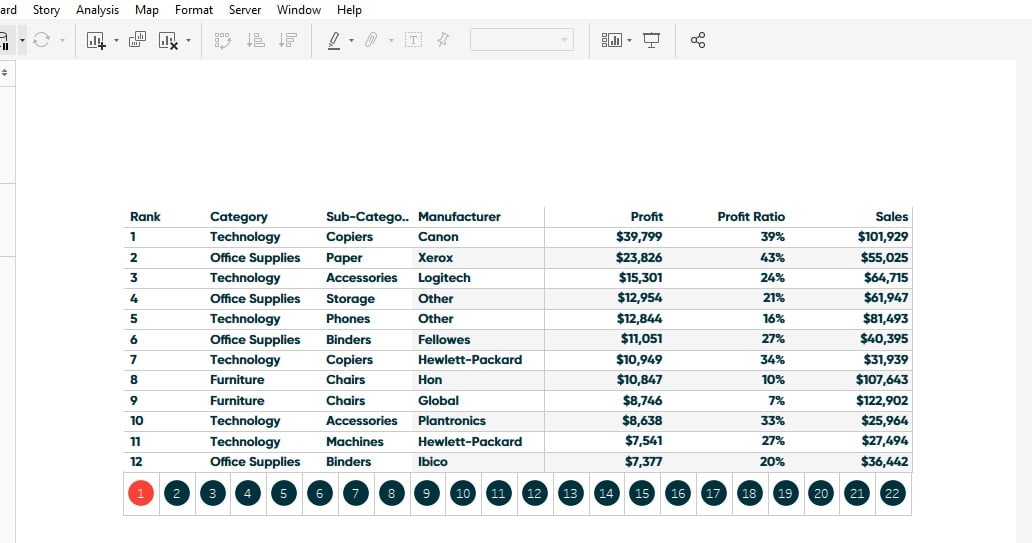
What are the coordinates of `column` in the screenshot? It's located at (163, 212), (259, 220), (368, 214), (462, 211), (645, 217), (749, 212), (904, 214).